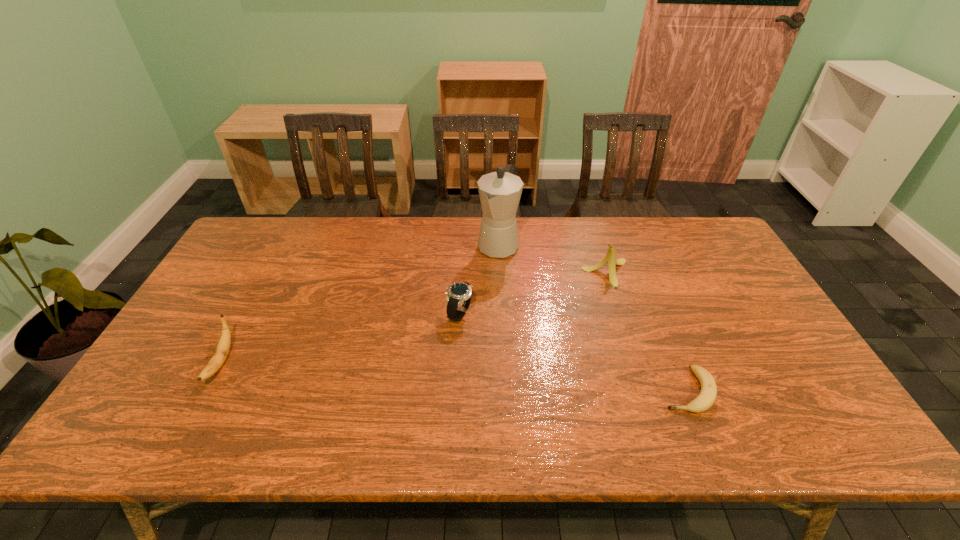
Find the location of `vacant area that lies between the watch and the coffeepot`. vacant area that lies between the watch and the coffeepot is located at coordinates (479, 279).

I want to click on empty space that is in between the second tallest banana and the shortest banana, so click(x=454, y=376).

Identify the location of vacant area that lies between the third object from left to right and the farthest banana. (552, 259).

The image size is (960, 540). What are the coordinates of `object that is the fourth closest one to the leftmost banana` in the screenshot? It's located at (707, 396).

Point out which object is positioned as the second nearest to the shortest banana. Please provide its 2D coordinates. Your answer should be formatted as a tuple, i.e. [(x, y)], where the tuple contains the x and y coordinates of a point satisfying the conditions above.

[(459, 294)]

The width and height of the screenshot is (960, 540). What are the coordinates of `the second closest banana to the shortest banana` in the screenshot? It's located at (223, 346).

This screenshot has width=960, height=540. Identify the location of banana identified as the second closest to the second object from left to right. (707, 396).

Locate an element on the screen. vacant space that satisfies the following two spatial constraints: 1. on the front side of the shortest banana; 2. on the left side of the coffeepot is located at coordinates (505, 390).

Identify the location of free location that satisfies the following two spatial constraints: 1. on the back side of the coffeepot; 2. on the left side of the second object from left to right. The height and width of the screenshot is (540, 960). (463, 245).

The height and width of the screenshot is (540, 960). Identify the location of free point that satisfies the following two spatial constraints: 1. on the peel of the leftmost object from the top; 2. on the left side of the shortest object. coord(206,390).